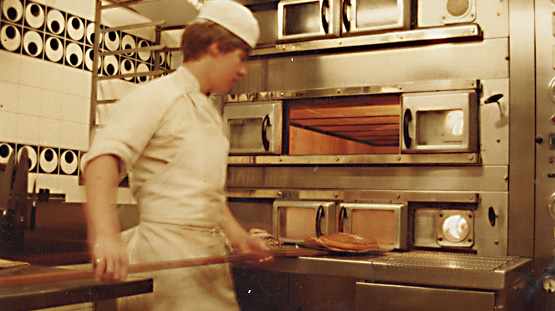
Where is `wall`? The height and width of the screenshot is (311, 555). wall is located at coordinates (70, 37), (64, 96), (65, 171).